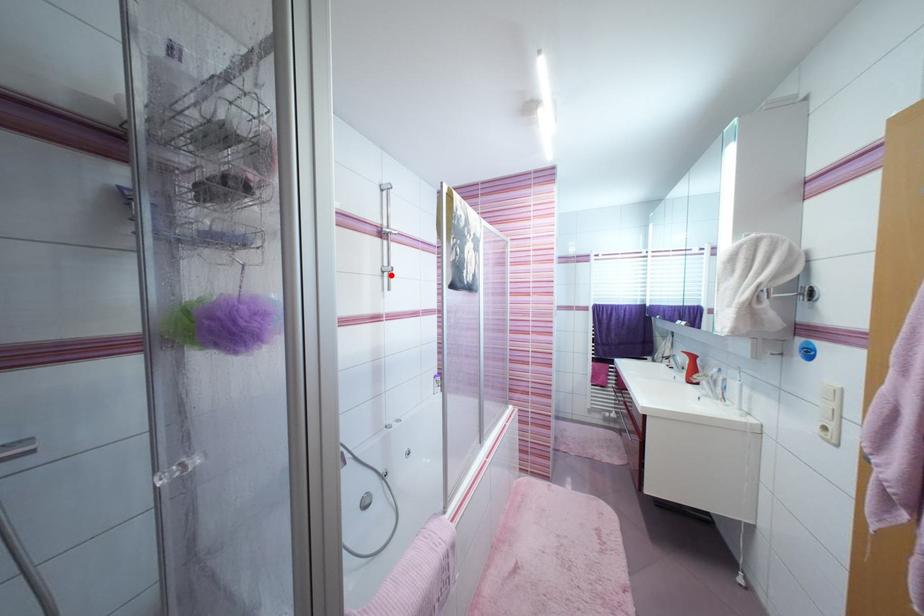
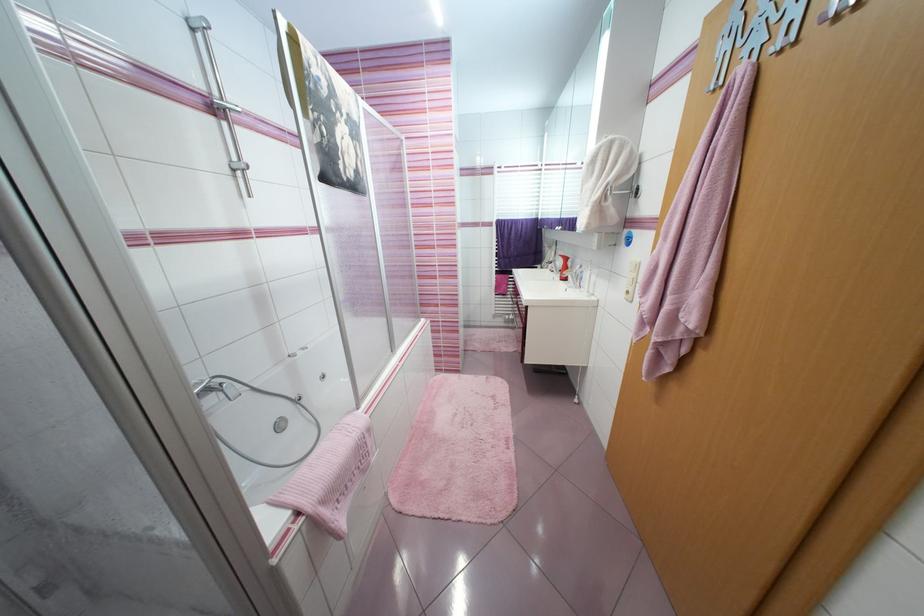
In the second image, find the point that corresponds to the highlighted location in the first image.

(245, 175)